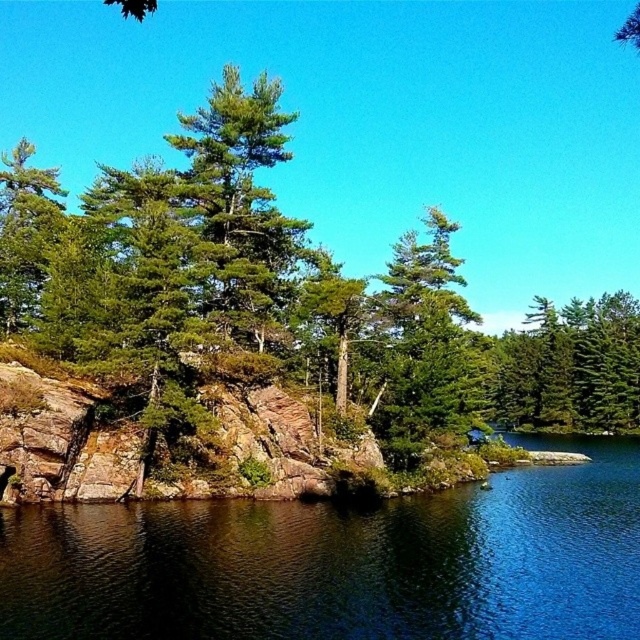
Question: Which of the following is the farthest from the observer?

Choices:
 (A) blue reflective water at lower center
 (B) green matte tree at left
 (C) green matte tree at center

Answer: (B)

Question: Can you confirm if green textured rock at center is bigger than blue reflective water at lower center?

Choices:
 (A) no
 (B) yes

Answer: (B)

Question: Which point is farther to the camera?

Choices:
 (A) green matte tree at left
 (B) green needle-like tree at center
 (C) green textured rock at center
 (D) green matte tree at upper right

Answer: (D)

Question: Which object is farther from the camera taking this photo?

Choices:
 (A) green textured rock at center
 (B) green matte tree at left

Answer: (B)

Question: Is blue reflective water at lower center above green matte tree at left?

Choices:
 (A) no
 (B) yes

Answer: (A)

Question: Is green matte tree at upper right to the right of green matte tree at left from the viewer's perspective?

Choices:
 (A) yes
 (B) no

Answer: (A)